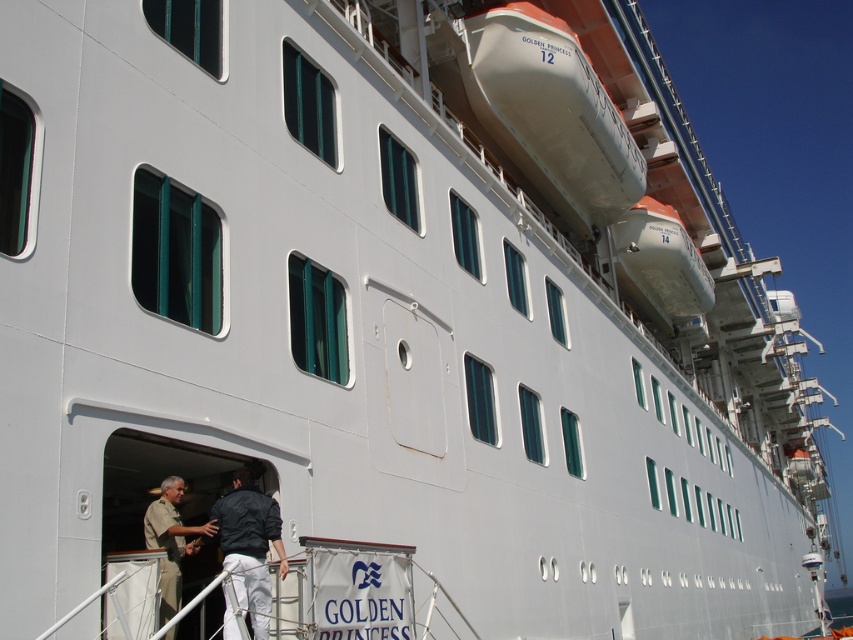
Question: Which object appears closest to the camera in this image?

Choices:
 (A) dark blue fabric jacket at lower left
 (B) khaki uniform at lower left

Answer: (A)

Question: Can you confirm if dark blue fabric jacket at lower left is positioned to the left of khaki uniform at lower left?

Choices:
 (A) yes
 (B) no

Answer: (B)

Question: Does dark blue fabric jacket at lower left have a greater width compared to khaki uniform at lower left?

Choices:
 (A) yes
 (B) no

Answer: (B)

Question: Does dark blue fabric jacket at lower left appear over khaki uniform at lower left?

Choices:
 (A) no
 (B) yes

Answer: (B)